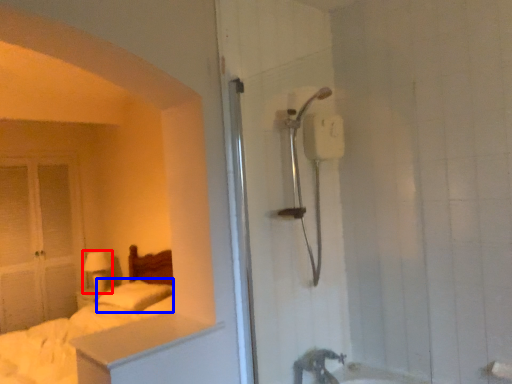
Question: Which point is closer to the camera, lamp (highlighted by a red box) or pillow (highlighted by a blue box)?

Choices:
 (A) lamp
 (B) pillow

Answer: (B)